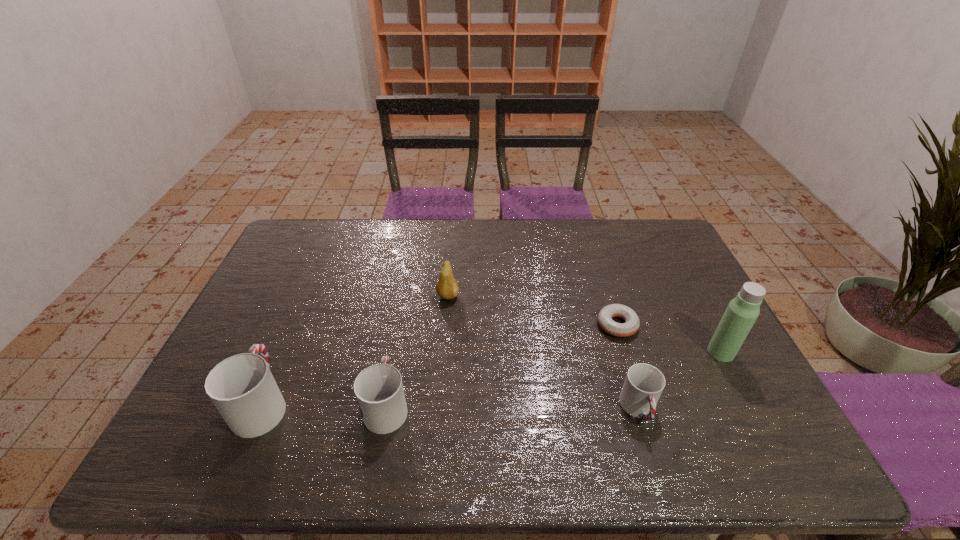
Locate an element on the screen. free space between the pear and the rightmost cup is located at coordinates (543, 353).

This screenshot has height=540, width=960. In order to click on free space that is in between the fifth nearest object and the leftmost object in this screenshot , I will do `click(440, 364)`.

Locate an element on the screen. The image size is (960, 540). empty space that is in between the second tallest cup and the farthest object is located at coordinates (418, 350).

You are a GUI agent. You are given a task and a screenshot of the screen. Output one action in this format:
    pyautogui.click(x=<x>, y=<y>)
    Task: Click on the free space between the thermos bottle and the second object from left to right
    This screenshot has height=540, width=960.
    Given the screenshot: What is the action you would take?
    pyautogui.click(x=554, y=379)

Identify the location of empty space between the rightmost object and the fifth tallest object. (680, 381).

Where is `empty space between the second object from left to right and the third farthest object`? empty space between the second object from left to right and the third farthest object is located at coordinates (554, 379).

Where is `empty space that is in between the shortest cup and the shortest object`? Image resolution: width=960 pixels, height=540 pixels. empty space that is in between the shortest cup and the shortest object is located at coordinates (628, 367).

Locate an element on the screen. The height and width of the screenshot is (540, 960). empty space between the shortest cup and the pear is located at coordinates (543, 353).

The height and width of the screenshot is (540, 960). Find the location of `free spot between the thermos bottle and the leftmost cup`. free spot between the thermos bottle and the leftmost cup is located at coordinates (492, 378).

Locate which object ranks in proximity to the second cup from right to left. Please provide its 2D coordinates. Your answer should be formatted as a tuple, i.e. [(x, y)], where the tuple contains the x and y coordinates of a point satisfying the conditions above.

[(242, 388)]